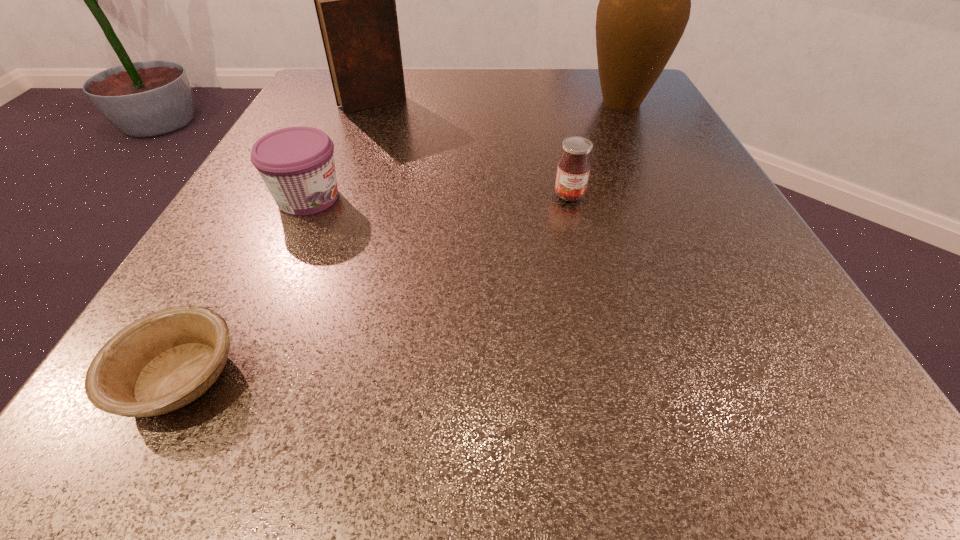
Image resolution: width=960 pixels, height=540 pixels. What are the coordinates of `the rightmost object` in the screenshot? It's located at (645, 0).

Locate an element on the screen. This screenshot has height=540, width=960. urn is located at coordinates 645,0.

What are the coordinates of `the second tallest object` in the screenshot? It's located at (355, 0).

Find the location of a particular element. the left jam is located at coordinates (297, 165).

Where is `the second object from right to left`? The width and height of the screenshot is (960, 540). the second object from right to left is located at coordinates (573, 170).

Find the location of a particular element. the nearest object is located at coordinates (163, 361).

Locate an element on the screen. Image resolution: width=960 pixels, height=540 pixels. bowl is located at coordinates click(x=163, y=361).

Identify the location of vacant space located on the front of the urn. The width and height of the screenshot is (960, 540). (655, 168).

Find the location of a particular element. The width and height of the screenshot is (960, 540). free space located on the back of the Bible is located at coordinates (382, 79).

Find the location of a particular element. The width and height of the screenshot is (960, 540). free spot located 0.210m on the front label of the left jam is located at coordinates (478, 198).